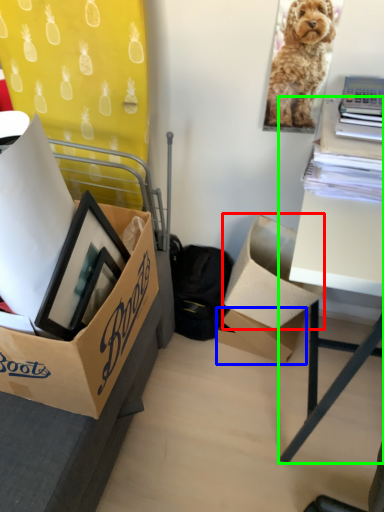
Question: Which object is positioned farthest from box (highlighted by a red box)? Select from box (highlighted by a blue box) and table (highlighted by a green box).

Choices:
 (A) box
 (B) table

Answer: (B)